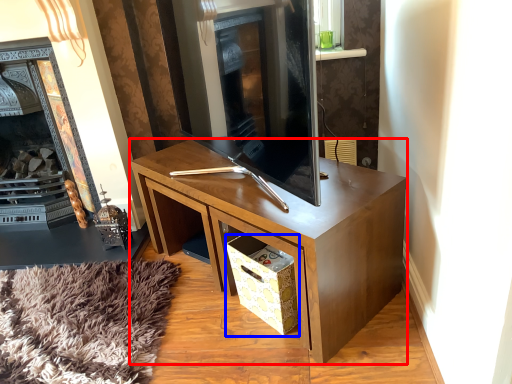
Question: Which of the following is the farthest to the observer, desk (highlighted by a red box) or drawer (highlighted by a blue box)?

Choices:
 (A) desk
 (B) drawer

Answer: (B)